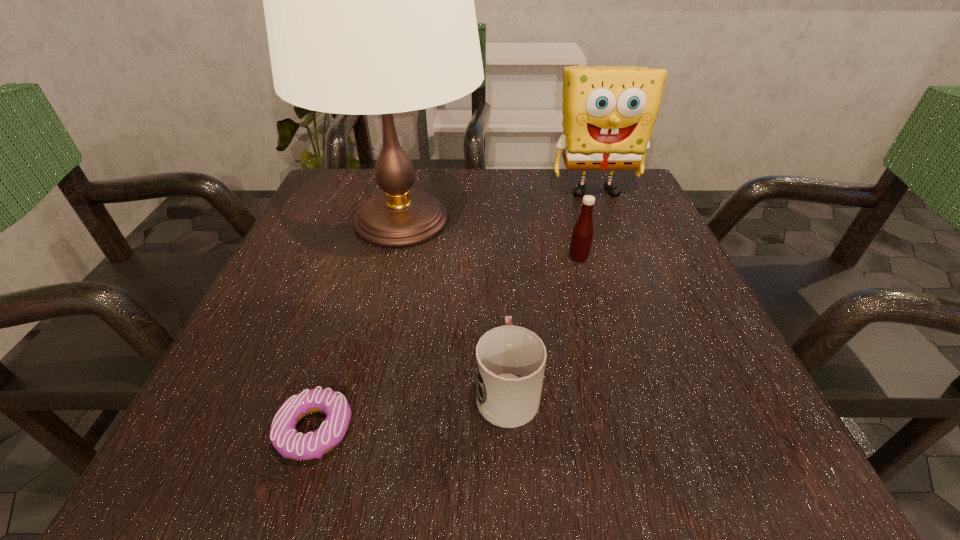
Where is `lamp`? The image size is (960, 540). lamp is located at coordinates (369, 6).

At what (x,y) coordinates should I click in order to perform the action: click on the fourth shortest object. Please return your answer as a coordinate pair (x, y). This screenshot has height=540, width=960. Looking at the image, I should click on (609, 112).

I want to click on Tabasco sauce, so click(582, 235).

You are a GUI agent. You are given a task and a screenshot of the screen. Output one action in this format:
    pyautogui.click(x=<x>, y=<y>)
    Task: Click on the cup
    Image resolution: width=960 pixels, height=540 pixels.
    Given the screenshot: What is the action you would take?
    pyautogui.click(x=510, y=360)

At what (x,y) coordinates should I click in order to perform the action: click on the shortest object. Please return your answer as a coordinate pair (x, y). The image size is (960, 540). Looking at the image, I should click on (285, 438).

Find the location of a particular element. The height and width of the screenshot is (540, 960). free spot located 0.350m on the front of the lamp is located at coordinates (345, 460).

Image resolution: width=960 pixels, height=540 pixels. In order to click on vacant space situated 0.090m on the face of the sponge in this screenshot , I will do `click(611, 232)`.

Image resolution: width=960 pixels, height=540 pixels. Identify the location of free region located 0.350m on the left of the third tallest object. (383, 258).

Find the location of a particular element. This screenshot has width=960, height=540. free point located on the handle side of the cup is located at coordinates [x=503, y=306].

Where is `free point located on the handle side of the cup`? free point located on the handle side of the cup is located at coordinates (500, 264).